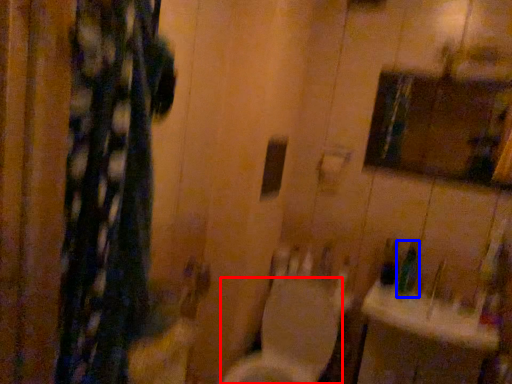
Question: Which point is closer to the camera, toilet (highlighted by a red box) or toiletry (highlighted by a blue box)?

Choices:
 (A) toilet
 (B) toiletry

Answer: (A)